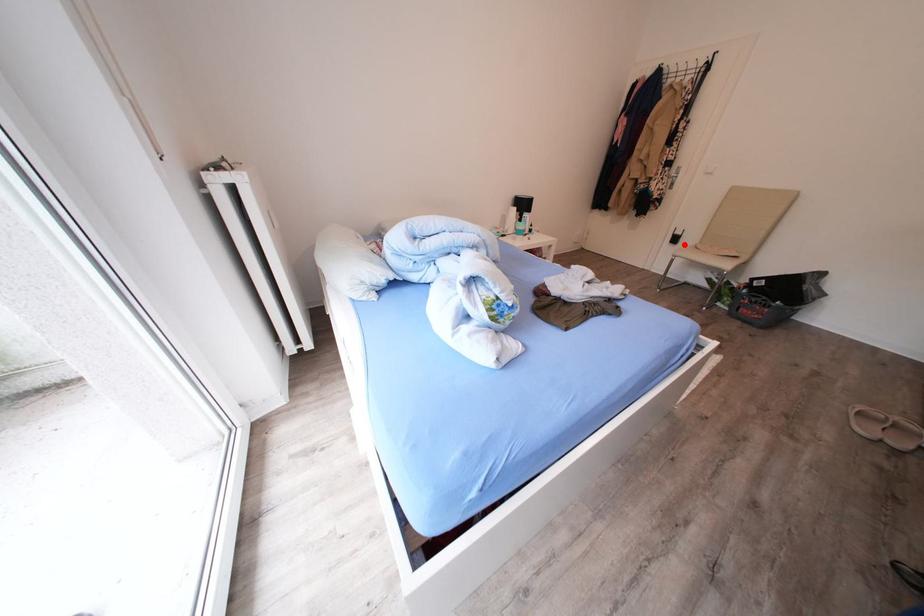
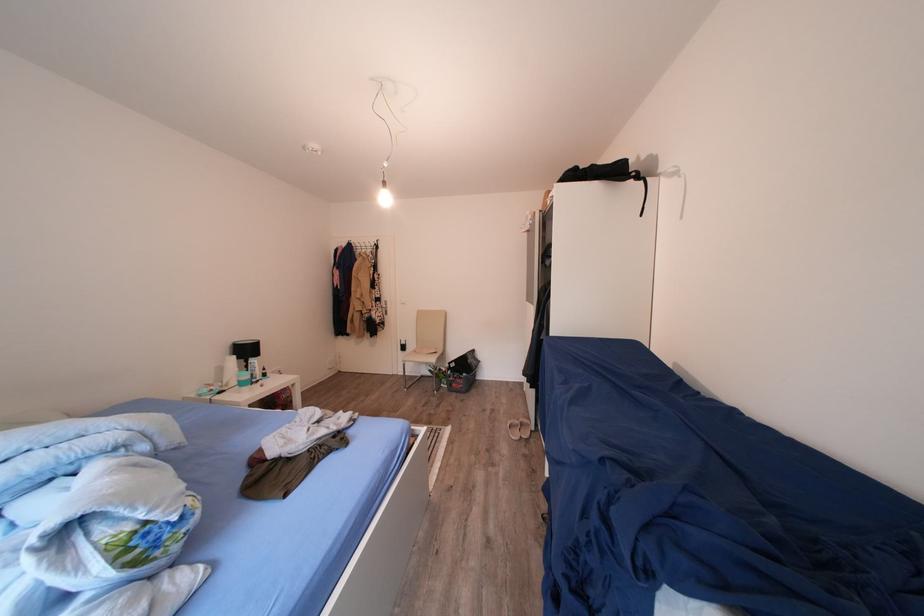
The point at the highlighted location is marked in the first image. Where is the corresponding point in the second image?

(411, 353)